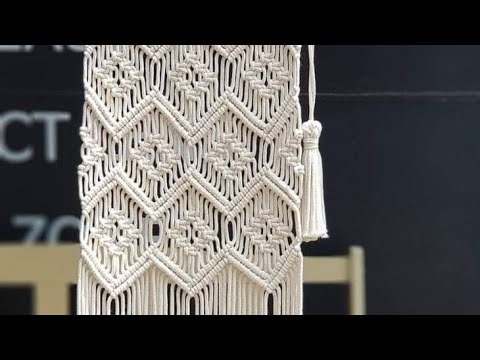
Locate an element on the screen. empty space to the right of chair is located at coordinates pyautogui.click(x=395, y=273).